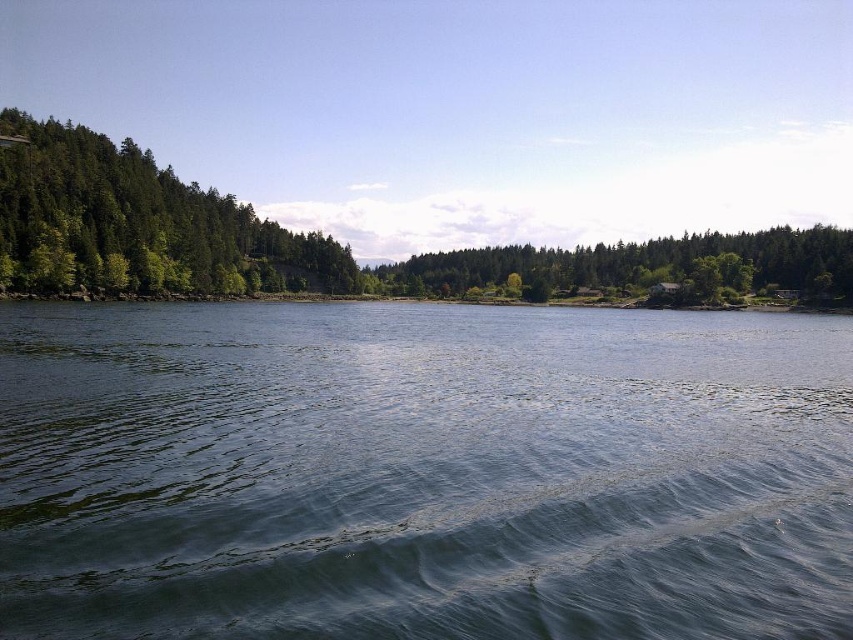
Measure the distance between clear water at center and camera.

12.19 meters

Locate an element on the screen. Image resolution: width=853 pixels, height=640 pixels. clear water at center is located at coordinates (422, 474).

Which is in front, point (361, 483) or point (102, 260)?

Point (361, 483) is more forward.

Locate an element on the screen. This screenshot has width=853, height=640. clear water at center is located at coordinates (422, 474).

Does point (180, 278) come in front of point (663, 269)?

Yes, it is in front of point (663, 269).

Consider the image. Is green matte forest at center wider than green matte tree at center?

Yes.

Find the location of a particular element. The height and width of the screenshot is (640, 853). green matte forest at center is located at coordinates (303, 236).

Who is positioned more to the left, clear water at center or green matte tree at center?

green matte tree at center is more to the left.

Measure the distance between point (757, 332) and camera.

They are 300.57 feet apart.

Where is `clear water at center`? Image resolution: width=853 pixels, height=640 pixels. clear water at center is located at coordinates (422, 474).